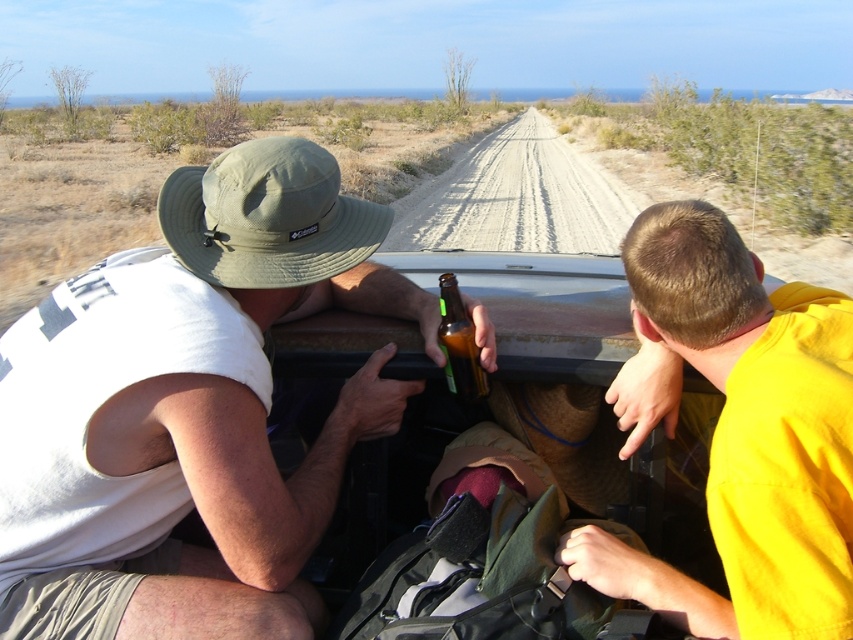
You are a passenger in the vehicle and need to locate the matte green hat at upper left. What are its coordinates?

The matte green hat at upper left is located at coordinates point (189, 410).

You are a passenger in the vehicle and want to reach the beer bottle held by the person in the green bucket hat. The beer bottle is at point (x=309, y=285) and there is an obstacle at point (x=782, y=317). Can you safely reach the beer bottle without touching the obstacle?

Point (x=309, y=285) is closer to you than point (x=782, y=317), so you can safely reach the beer bottle without touching the obstacle.

You are a passenger in the vehicle and want to place the brown glass bottle at center on the dashboard between the yellow matte truck at right and another object. Considering their widths, will the bottle fit without touching either side?

The yellow matte truck at right is wider than the brown glass bottle at center. Since the truck is wider, the bottle might not fit between them without touching the truck unless there is sufficient space. However, the description only mentions the truck being wider, not the exact dimensions of the dashboard or the distance between the truck and the other object. Without additional spatial details, it is uncertain if the bottle will fit.